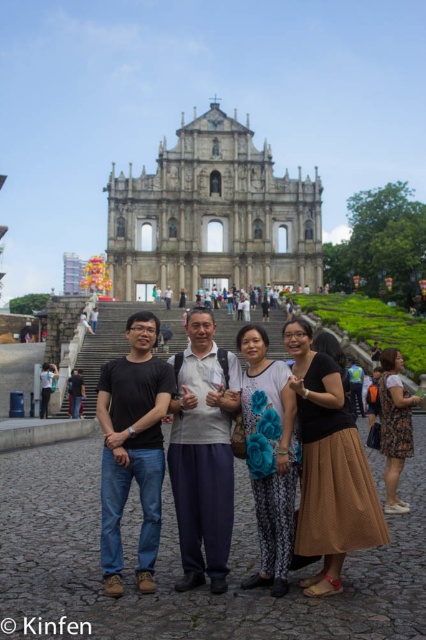
Is white cotton shirt at center above floral-patterned dress at lower right?

Indeed, white cotton shirt at center is positioned over floral-patterned dress at lower right.

Is white cotton shirt at center smaller than floral-patterned dress at lower right?

Incorrect, white cotton shirt at center is not smaller in size than floral-patterned dress at lower right.

What do you see at coordinates (203, 452) in the screenshot? This screenshot has height=640, width=426. I see `white cotton shirt at center` at bounding box center [203, 452].

This screenshot has height=640, width=426. I want to click on white cotton shirt at center, so click(x=203, y=452).

Is matte blue fabric purse at center smaller than black fabric backpack at center?

No.

Is matte blue fabric purse at center further to the viewer compared to black fabric backpack at center?

No, matte blue fabric purse at center is closer to the viewer.

Find the location of `matte blue fabric purse at center`. matte blue fabric purse at center is located at coordinates tap(268, 456).

Can you confirm if stone church at center is smaller than black fabric backpack at center?

Incorrect, stone church at center is not smaller in size than black fabric backpack at center.

What do you see at coordinates (212, 216) in the screenshot?
I see `stone church at center` at bounding box center [212, 216].

This screenshot has height=640, width=426. In order to click on stone church at center in this screenshot , I will do `click(212, 216)`.